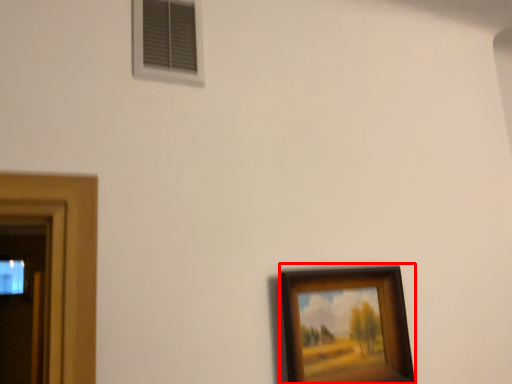
Question: Observing the image, what is the correct spatial positioning of picture frame (annotated by the red box) in reference to window?

Choices:
 (A) left
 (B) right

Answer: (B)